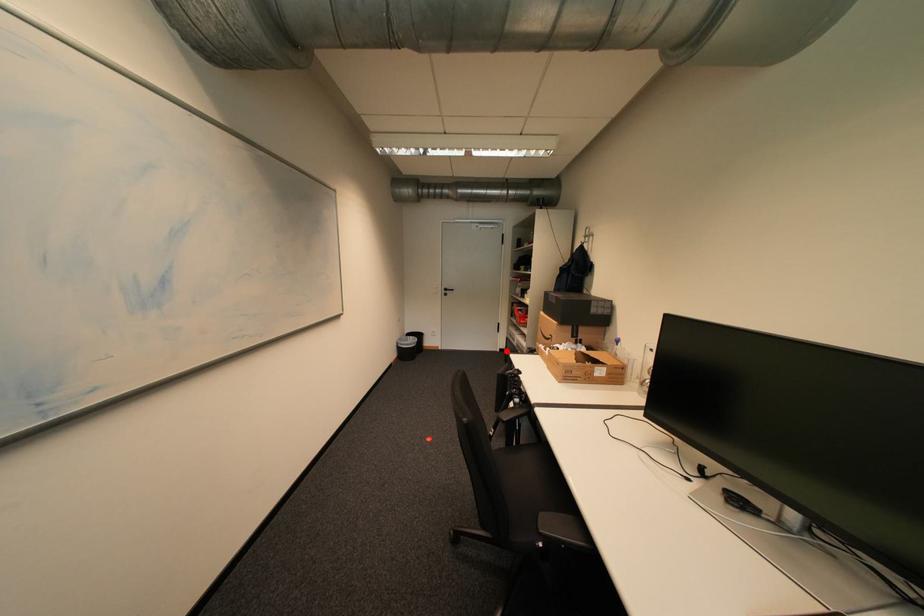
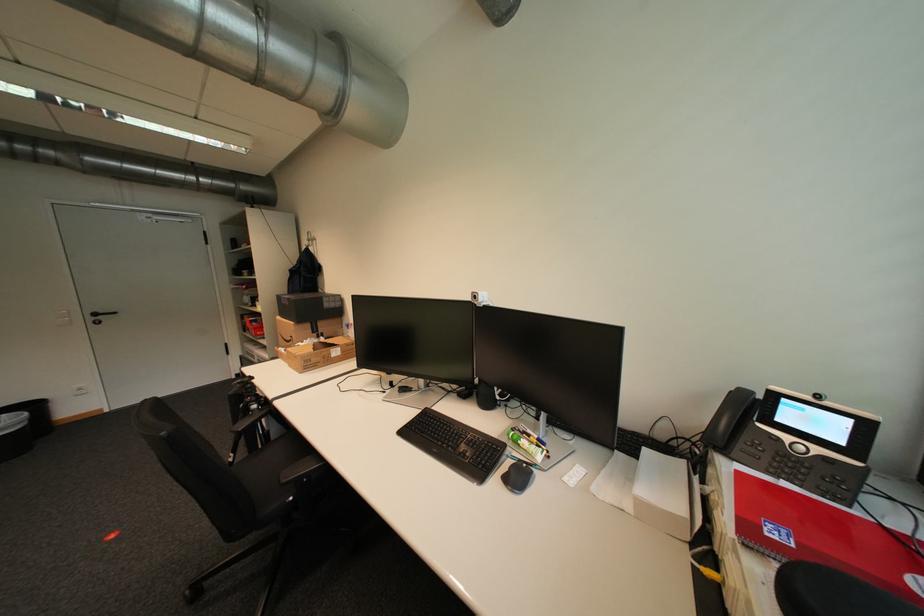
Question: I am providing you with two images of the same scene from different viewpoints. Given a red point in image1, look at the same physical point in image2. Is it:

Choices:
 (A) Closer to the viewpoint
 (B) Farther from the viewpoint

Answer: (B)